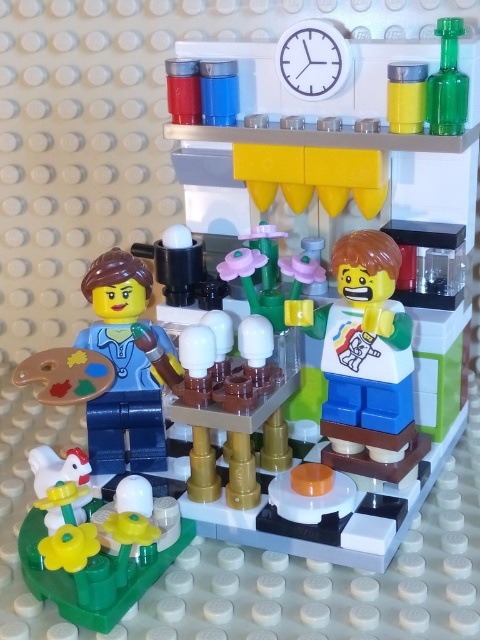
You are a tiny LEGO figure standing at the edge of the beige baseplate. You need to place a small LEGO brick on the tallest object in the scene. Which object should you choose between the smooth white plate at center and the yellow matte flower at lower left?

The smooth white plate at center is much taller than the yellow matte flower at lower left, so you should place the small LEGO brick on the smooth white plate at center.